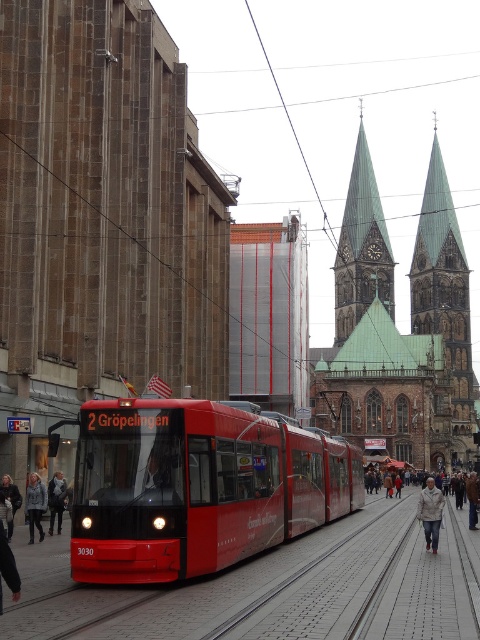
Question: Does light beige jacket at center appear under dark gray knit sweater at lower left?

Choices:
 (A) yes
 (B) no

Answer: (A)

Question: Is brown stone church at center wider than light beige jacket at lower left?

Choices:
 (A) no
 (B) yes

Answer: (B)

Question: Which object is farther from the camera taking this photo?

Choices:
 (A) brown stone church at center
 (B) white textured coat at lower center
 (C) brown leather jacket at lower right
 (D) light beige jacket at lower left

Answer: (C)

Question: Which of the following is the closest to the observer?

Choices:
 (A) green stone church at upper center
 (B) shiny red tram at center

Answer: (B)

Question: Estimate the real-world distances between objects in this image. Which object is farther from the light beige jacket at lower left?

Choices:
 (A) dark gray knit sweater at lower left
 (B) light gray fleece jacket at lower left
 (C) white textured coat at lower center

Answer: (C)

Question: Can you confirm if brown stone church at center is positioned below light beige jacket at center?

Choices:
 (A) no
 (B) yes

Answer: (A)